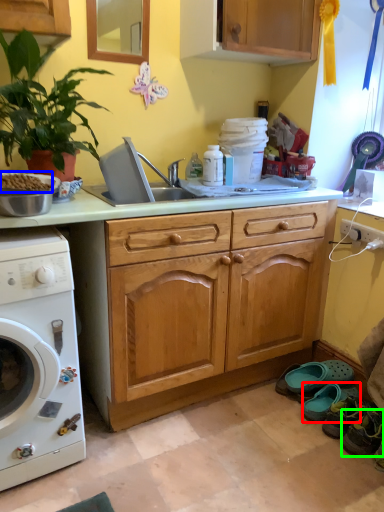
Question: Which is farther away from shoe (highlighted by a red box)? food (highlighted by a blue box) or shoe (highlighted by a green box)?

Choices:
 (A) food
 (B) shoe

Answer: (A)